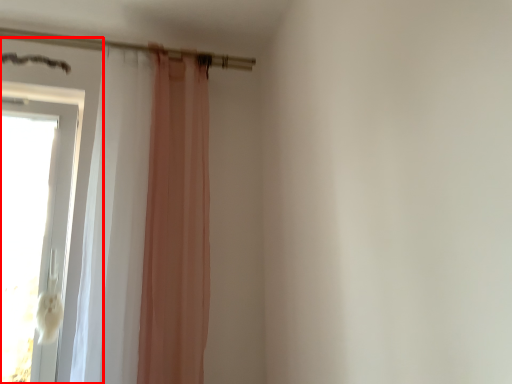
Question: Considering the relative positions of door (annotated by the red box) and shower curtain in the image provided, where is door (annotated by the red box) located with respect to the staircase?

Choices:
 (A) left
 (B) right

Answer: (A)